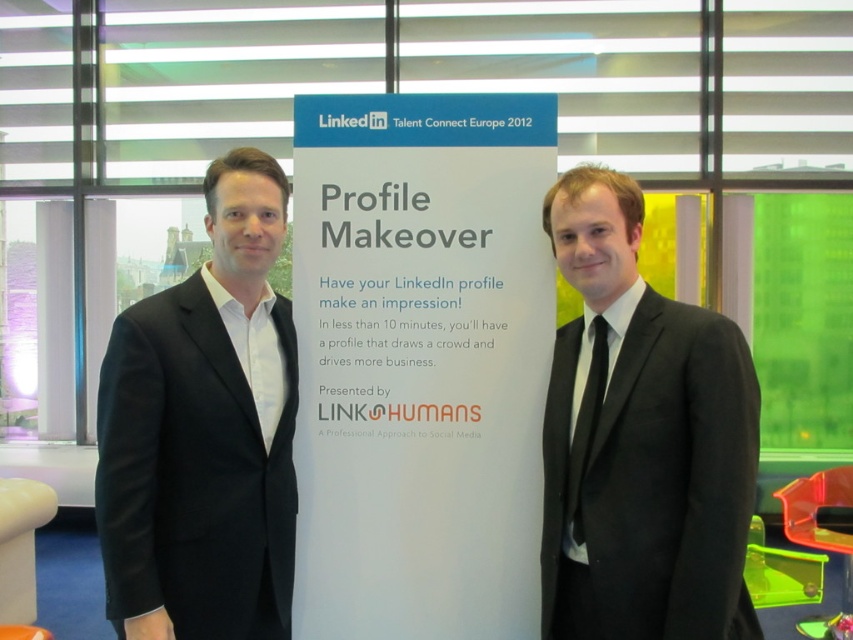
Question: Among these points, which one is farthest from the camera?

Choices:
 (A) (219, 637)
 (B) (699, 580)
 (C) (596, 372)
 (D) (334, 241)

Answer: (D)

Question: Estimate the real-world distances between objects in this image. Which object is closer to the black silk tie at right?

Choices:
 (A) black matte suit at left
 (B) black matte suit at right
 (C) white paper at center

Answer: (B)

Question: Which point appears farthest from the camera in this image?

Choices:
 (A) (664, 346)
 (B) (593, 326)

Answer: (B)

Question: Is black matte suit at right to the left of black silk tie at right from the viewer's perspective?

Choices:
 (A) no
 (B) yes

Answer: (A)

Question: Does white paper at center have a lesser width compared to black matte suit at right?

Choices:
 (A) yes
 (B) no

Answer: (B)

Question: Is black matte suit at right positioned behind black silk tie at right?

Choices:
 (A) no
 (B) yes

Answer: (A)